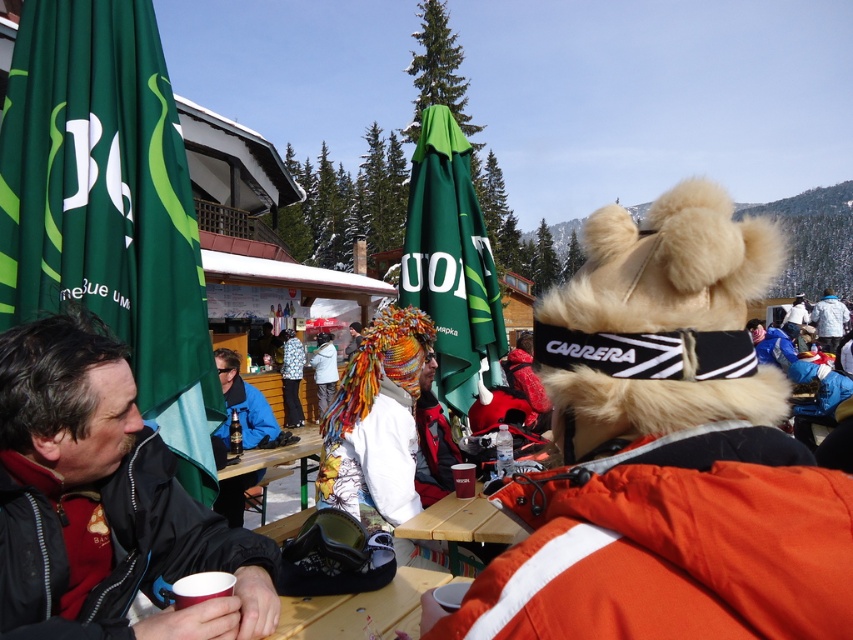
Question: Can you confirm if matte black jacket at center is bigger than wooden picnic table at center?

Choices:
 (A) no
 (B) yes

Answer: (A)

Question: Is furry orange jacket at upper right positioned at the back of blue fleece jacket at center?

Choices:
 (A) no
 (B) yes

Answer: (A)

Question: Which point appears farthest from the camera in this image?

Choices:
 (A) (415, 248)
 (B) (47, 186)
 (C) (469, 532)

Answer: (A)

Question: Which object is closer to the camera taking this photo?

Choices:
 (A) matte black jacket at center
 (B) white fleece jacket at upper right
 (C) wooden picnic table at center

Answer: (A)

Question: Can you confirm if wooden table at lower center is wider than white fleece jacket at upper right?

Choices:
 (A) no
 (B) yes

Answer: (A)

Question: Which object appears closest to the camera in this image?

Choices:
 (A) wooden table at center
 (B) wooden table at lower center

Answer: (B)